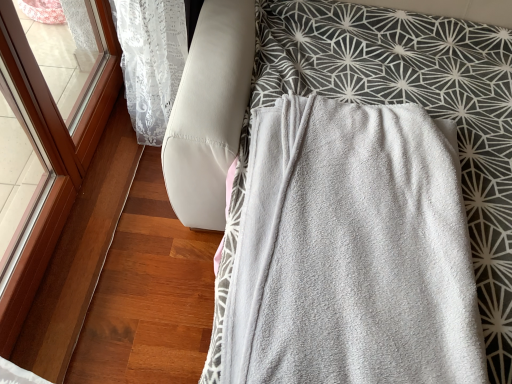
Locate an element on the screen. Image resolution: width=512 pixels, height=384 pixels. gray soft blanket at center is located at coordinates (351, 101).

The width and height of the screenshot is (512, 384). What do you see at coordinates (351, 101) in the screenshot?
I see `gray soft blanket at center` at bounding box center [351, 101].

You are a GUI agent. You are given a task and a screenshot of the screen. Output one action in this format:
    pyautogui.click(x=<x>, y=<y>)
    Task: Click on the gray soft blanket at center
    
    Given the screenshot: What is the action you would take?
    pos(351,101)